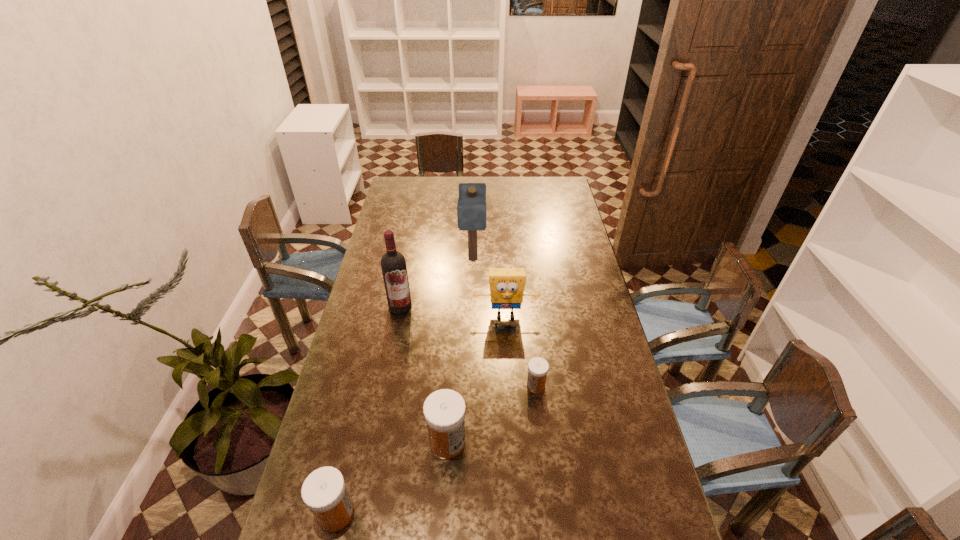
Where is `vacant space that's between the wine bottle and the second farthest medicine`? The height and width of the screenshot is (540, 960). vacant space that's between the wine bottle and the second farthest medicine is located at coordinates (423, 374).

Find the location of `empty space that is in between the third nearest object and the wine bottle`. empty space that is in between the third nearest object and the wine bottle is located at coordinates (468, 346).

Locate an element on the screen. The height and width of the screenshot is (540, 960). empty space between the shortest medicine and the sponge is located at coordinates (520, 350).

Find the location of a particular element. the fourth closest object to the sponge is located at coordinates (444, 410).

Select which object appears as the third closest to the wine bottle. Please provide its 2D coordinates. Your answer should be formatted as a tuple, i.e. [(x, y)], where the tuple contains the x and y coordinates of a point satisfying the conditions above.

[(444, 410)]

Find the location of a particular element. the second closest medicine to the wine bottle is located at coordinates (538, 367).

The image size is (960, 540). Find the location of `the third closest medicine to the mallet`. the third closest medicine to the mallet is located at coordinates (324, 492).

This screenshot has height=540, width=960. I want to click on vacant space that satisfies the following two spatial constraints: 1. on the label of the wine bottle; 2. on the right side of the second medicine from right to left, so click(374, 442).